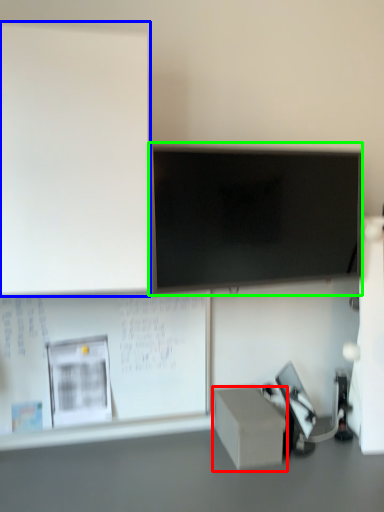
Question: Which object is the farthest from box (highlighted by a red box)? Choose among these: bulletin board (highlighted by a blue box) or television (highlighted by a green box).

Choices:
 (A) bulletin board
 (B) television

Answer: (A)